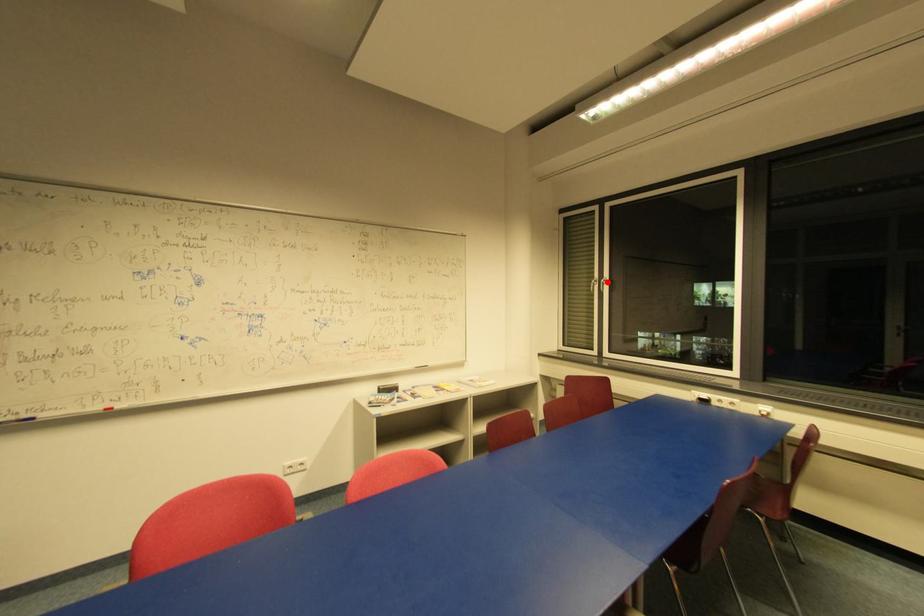
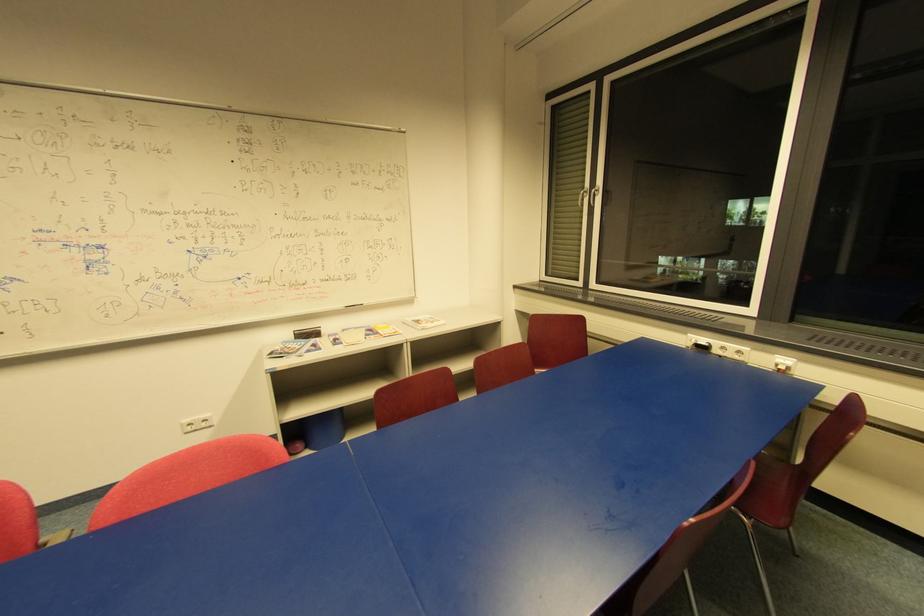
Question: I am providing you with two images of the same scene from different viewpoints. A red point is marked on the first image. Is the red point's position out of view in image 2?

Choices:
 (A) Yes
 (B) No

Answer: (B)